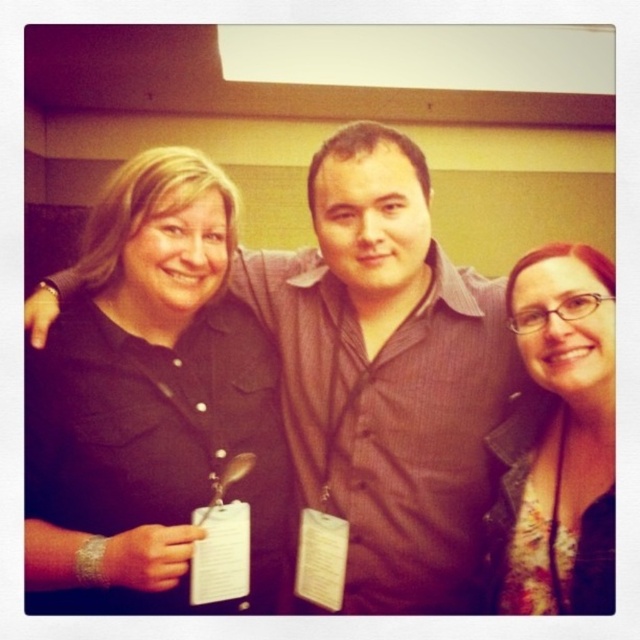
Can you confirm if black shirt at center is positioned to the left of floral fabric shirt at center?

Correct, you'll find black shirt at center to the left of floral fabric shirt at center.

Is black shirt at center positioned before floral fabric shirt at center?

No, black shirt at center is behind floral fabric shirt at center.

You are a GUI agent. You are given a task and a screenshot of the screen. Output one action in this format:
    pyautogui.click(x=<x>, y=<y>)
    Task: Click on the black shirt at center
    
    Given the screenshot: What is the action you would take?
    pyautogui.click(x=388, y=372)

Locate an element on the screen. Image resolution: width=640 pixels, height=640 pixels. black shirt at center is located at coordinates (388, 372).